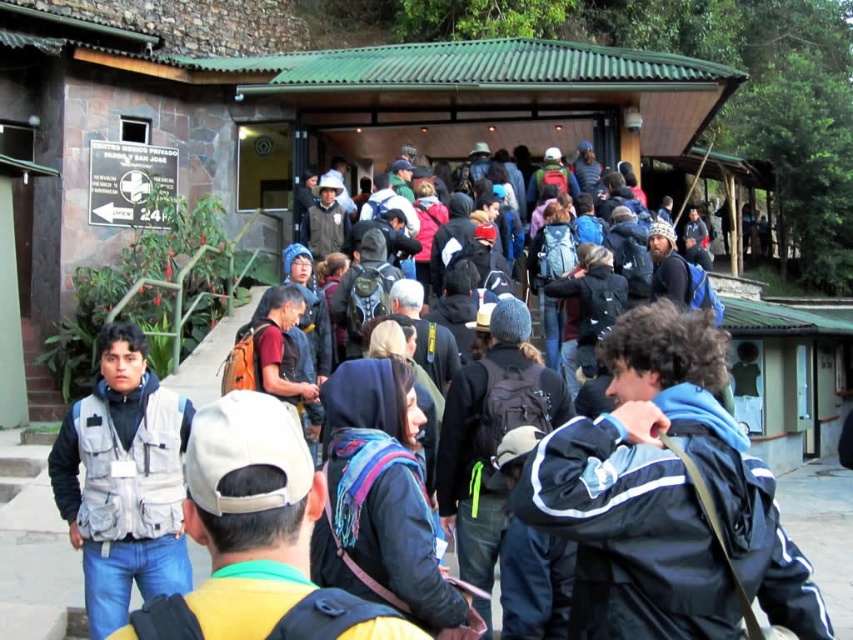
Is blue fabric jacket at center wider than gray fabric vest at center?

In fact, blue fabric jacket at center might be narrower than gray fabric vest at center.

Is point (763, 513) farther from viewer compared to point (80, 547)?

No, (763, 513) is in front of (80, 547).

I want to click on blue fabric jacket at center, so click(x=665, y=497).

From the picture: Which of these two, gray fabric vest at center or dark blue backpack at center, stands taller?

Standing taller between the two is dark blue backpack at center.

Which is in front, point (106, 326) or point (480, 476)?

Point (106, 326)

Find the location of a particular element. gray fabric vest at center is located at coordinates (123, 481).

Does blue fabric scarf at center have a lesser width compared to dark blue backpack at center?

In fact, blue fabric scarf at center might be wider than dark blue backpack at center.

At what (x,y) coordinates should I click in order to perform the action: click on blue fabric scarf at center. Please return your answer as a coordinate pair (x, y). This screenshot has width=853, height=640. Looking at the image, I should click on pyautogui.click(x=379, y=496).